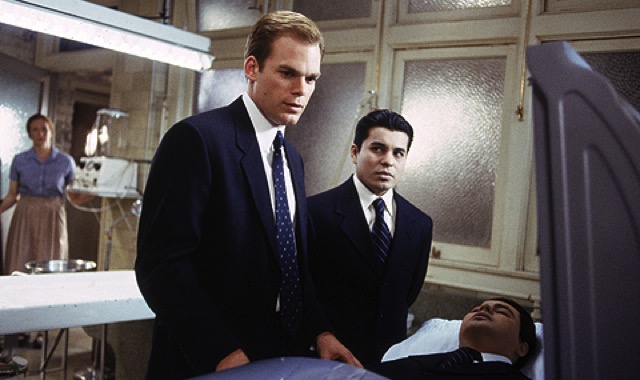
This screenshot has width=640, height=380. What are the coordinates of `table leg` in the screenshot? It's located at (66, 346), (44, 348).